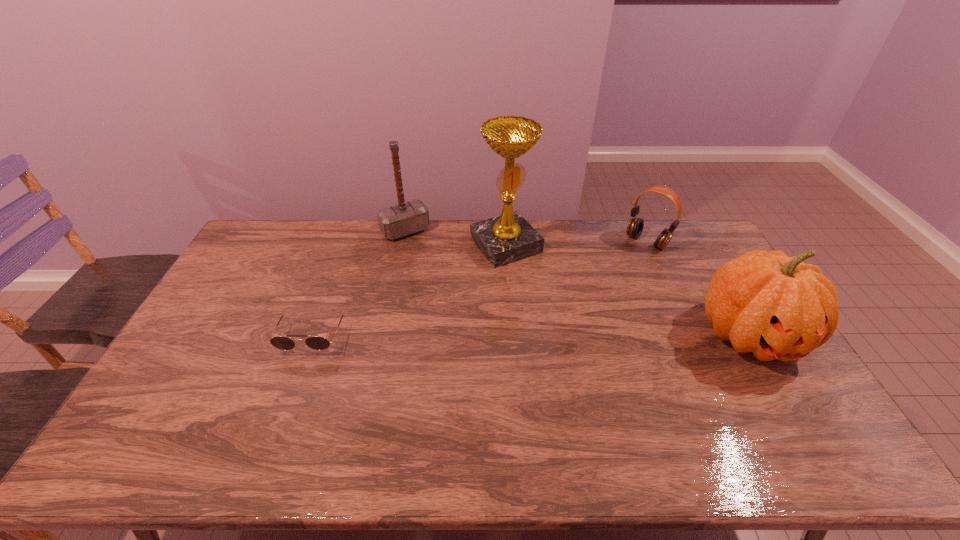
This screenshot has width=960, height=540. Find the location of `free space on the desktop that is between the leftmost object and the pumpkin and is positioned on the ear cups of the fourth tallest object`. free space on the desktop that is between the leftmost object and the pumpkin and is positioned on the ear cups of the fourth tallest object is located at coordinates (558, 335).

At what (x,y) coordinates should I click in order to perform the action: click on vacant space on the desktop that is between the shortest object and the pumpkin and is positioned on the front-facing side of the third object from left to right. Please return your answer as a coordinate pair (x, y). Looking at the image, I should click on (586, 335).

Image resolution: width=960 pixels, height=540 pixels. Find the location of `vacant space on the desktop that is between the shortest object and the pumpkin and is positioned on the striking surface of the fourth object from right to left`. vacant space on the desktop that is between the shortest object and the pumpkin and is positioned on the striking surface of the fourth object from right to left is located at coordinates (484, 335).